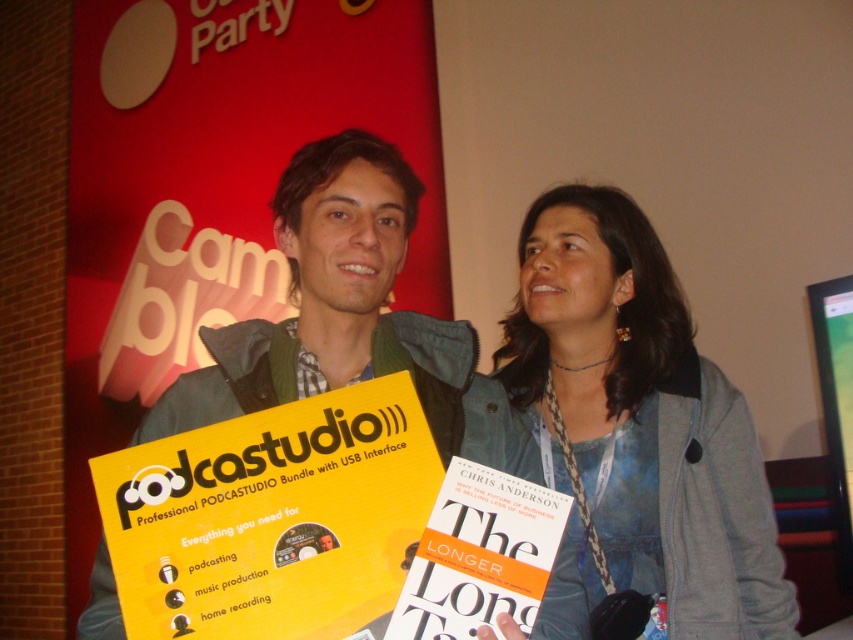
You are a photographer setting up for a photo shoot at the event. You want to ensure that the denim jacket at center and the yellow paperboard at center are both visible in the frame. Based on their positions, which object should you focus on first to capture both in the shot?

The denim jacket at center is located below the yellow paperboard at center. To capture both in the frame, you should focus on the yellow paperboard at center first, as it is higher up, ensuring the lower denim jacket at center remains within the shot.

What is the spatial relationship between the denim jacket at center and the other objects in the scene?

The denim jacket at center is positioned at coordinates point (x=642, y=419), but without additional object descriptions, its exact spatial relationship to other items cannot be determined.